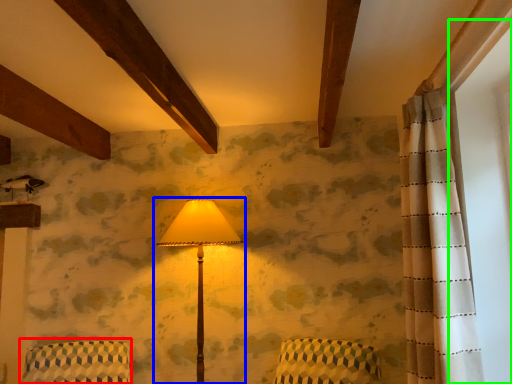
Question: Which object is the closest to the armchair (highlighted by a red box)? Choose among these: lamp (highlighted by a blue box) or window screen (highlighted by a green box).

Choices:
 (A) lamp
 (B) window screen

Answer: (A)